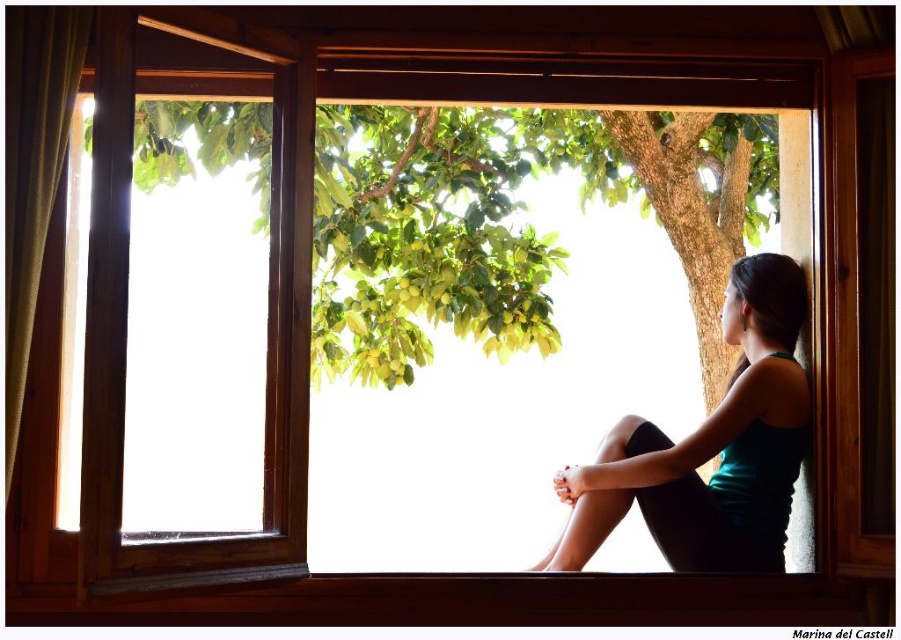
Question: Where is green leafy tree at center located in relation to green textured curtain at left in the image?

Choices:
 (A) above
 (B) below

Answer: (A)

Question: Can you confirm if green leafy tree at center is positioned above teal fabric tank top at right?

Choices:
 (A) no
 (B) yes

Answer: (B)

Question: Which of the following is the closest to the observer?

Choices:
 (A) (52, 189)
 (B) (669, 440)

Answer: (A)

Question: Which of the following is the farthest from the observer?

Choices:
 (A) green textured curtain at left
 (B) teal fabric tank top at right
 (C) green leafy tree at center

Answer: (C)

Question: Which object is farther from the camera taking this photo?

Choices:
 (A) teal fabric tank top at right
 (B) green leafy tree at center

Answer: (B)

Question: In this image, where is green leafy tree at center located relative to green textured curtain at left?

Choices:
 (A) above
 (B) below

Answer: (A)